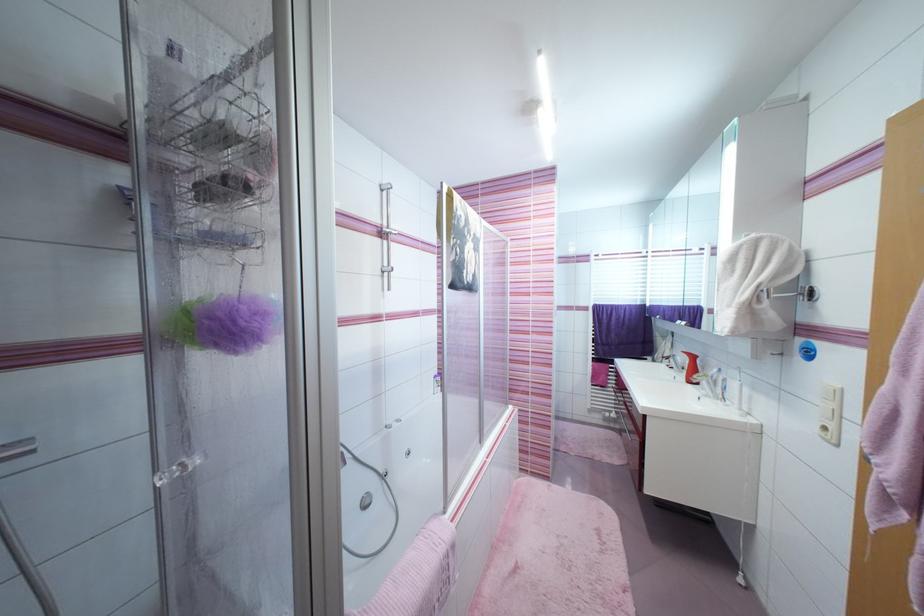
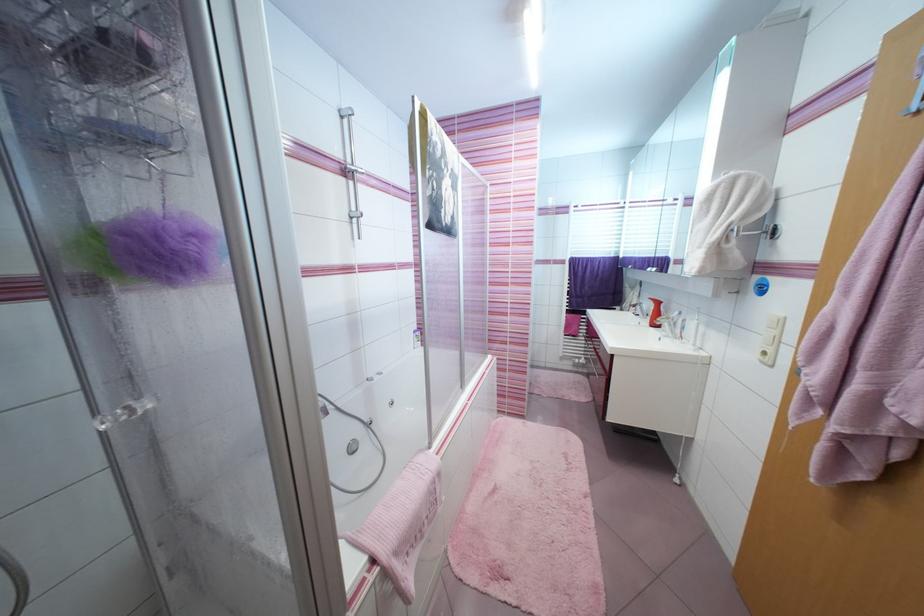
Question: The images are taken continuously from a first-person perspective. In which direction are you moving?

Choices:
 (A) Left
 (B) Right
 (C) Forward
 (D) Backward

Answer: (C)